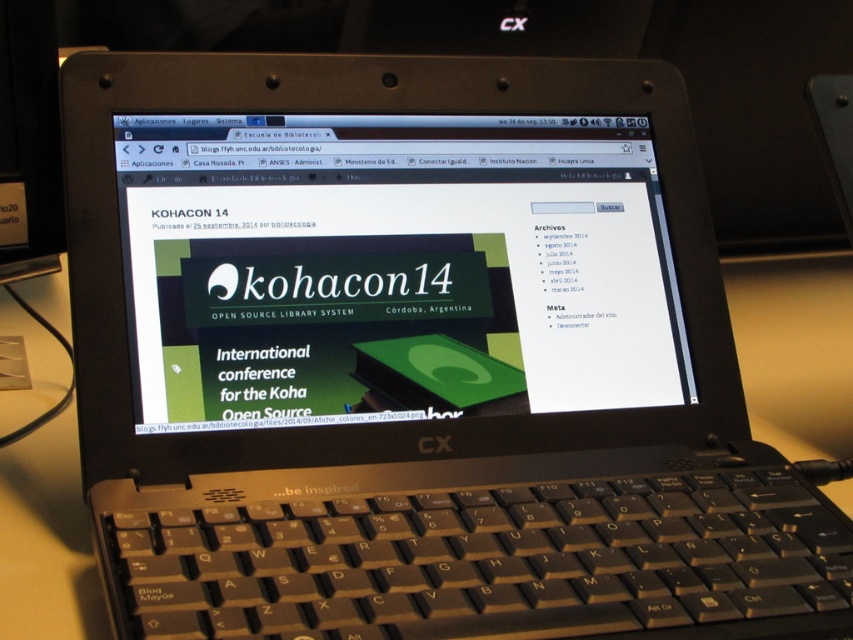
Question: Does green matte book at center appear over black plastic keyboard at lower center?

Choices:
 (A) no
 (B) yes

Answer: (B)

Question: Which object is closer to the camera taking this photo?

Choices:
 (A) green matte book at center
 (B) black plastic keyboard at lower center

Answer: (B)

Question: Is green matte book at center above black plastic keyboard at lower center?

Choices:
 (A) yes
 (B) no

Answer: (A)

Question: Can you confirm if green matte book at center is thinner than black plastic keyboard at lower center?

Choices:
 (A) yes
 (B) no

Answer: (A)